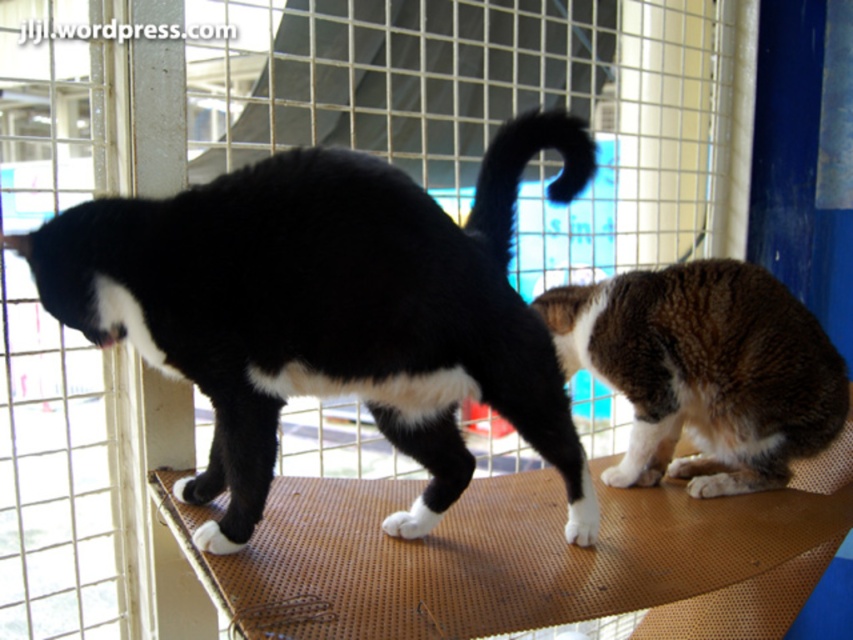
You are a caretaker trying to place a treat between the two cats. The first cat is at point (558, 326) and the second cat is at point (566, 156). Which cat is closer to you so you can toss the treat towards them first?

The cat at point (558, 326) is closer to you than the cat at point (566, 156), so you should toss the treat towards the cat at point (558, 326) first.

You are a veterinarian who needs to approach the brown shaggy cat at right for a checkup. Based on its current position, where should you approach it from?

The brown shaggy cat at right is positioned at coordinates point (704,371). To approach it safely, you should come from the left side since it is facing away from the camera, which is likely facing towards the right side of the image.